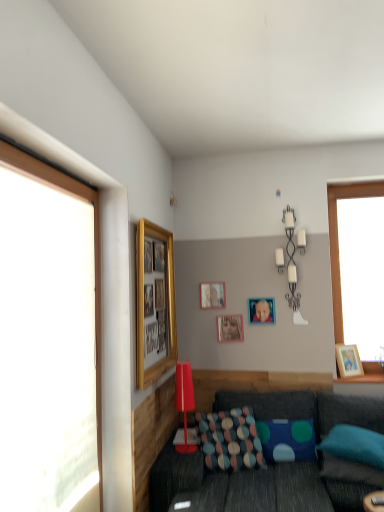
Question: From a real-world perspective, is wooden picture frame at right, the 1th picture frame positioned from the right, above or below blue fabric pillow at lower right, the 1th pillow when ordered from right to left?

Choices:
 (A) below
 (B) above

Answer: (B)

Question: From the image's perspective, relative to blue fabric pillow at lower right, the 1th pillow when ordered from right to left, is wooden picture frame at right, the fifth picture frame in the left-to-right sequence, above or below?

Choices:
 (A) below
 (B) above

Answer: (B)

Question: Estimate the real-world distances between objects in this image. Which object is farther from the wooden photo frame at center, positioned as the fourth picture frame in front-to-back order?

Choices:
 (A) gold/glossy picture frame at upper left, the 1th picture frame viewed from the front
 (B) metallic silver candle holder at upper center, which appears as the second lamp when viewed from the front
 (C) transparent glass window at left
 (D) matte red lamp at center, arranged as the 1th lamp when viewed from the front
 (E) matte gold picture frame at upper center, the 2th picture frame viewed from the left

Answer: (C)

Question: Which object is positioned closest to the metallic silver photo frame at center, the third picture frame viewed from the back?

Choices:
 (A) wooden picture frame at right, marked as the second picture frame in a front-to-back arrangement
 (B) transparent glass window at left
 (C) textured blue pillow at center, the 2th pillow positioned from the left
 (D) matte red lamp at center, arranged as the 2th lamp when viewed from the right
 (E) textured gray couch at lower center

Answer: (A)